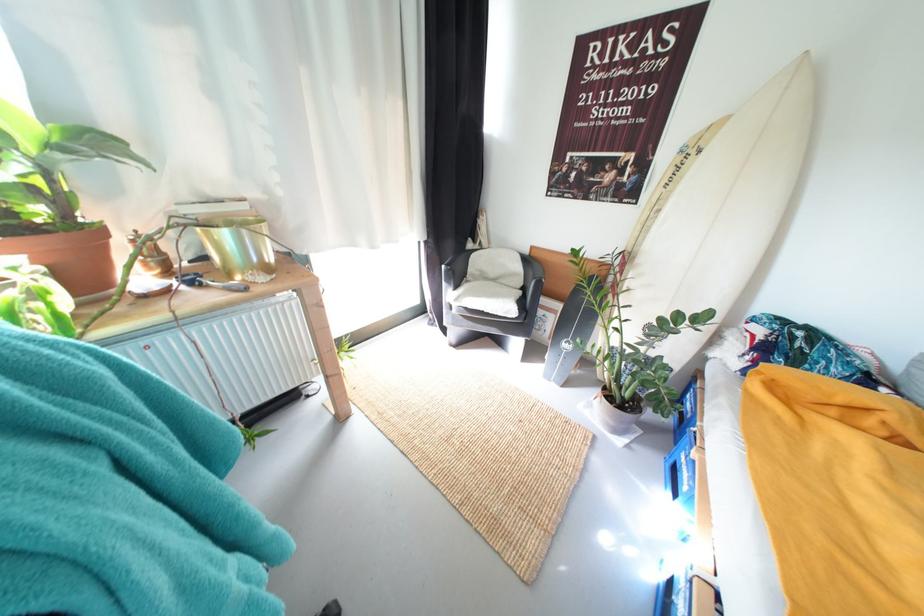
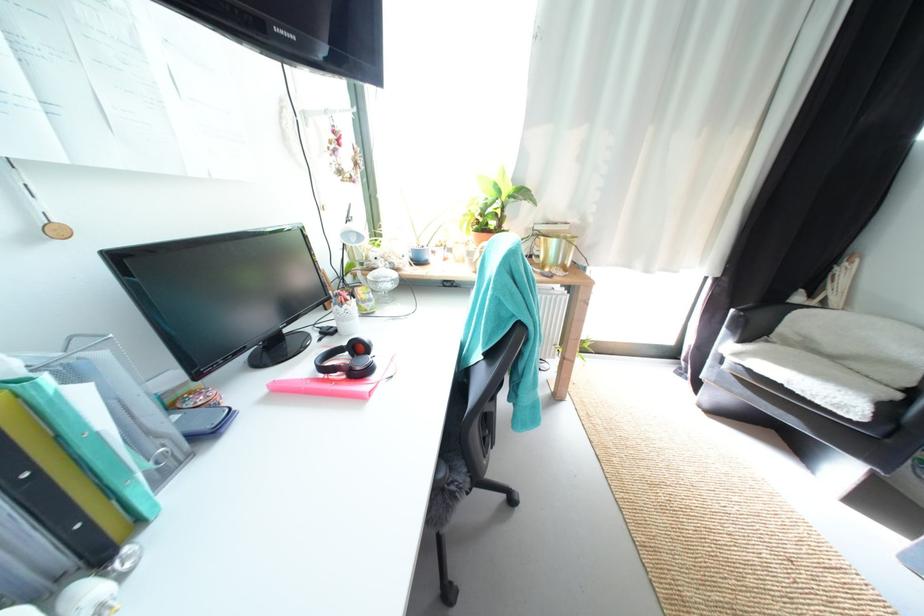
Find the pixel in the second image that matches (40,188) in the first image.

(505, 216)